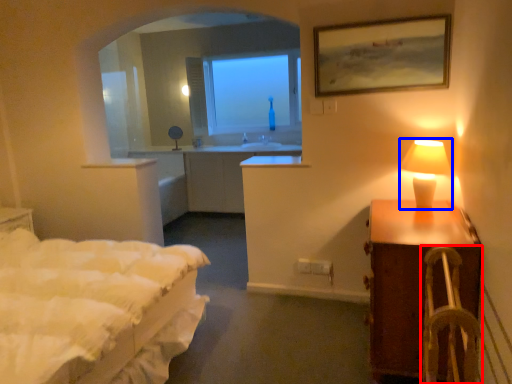
Question: Among these objects, which one is nearest to the camera, armchair (highlighted by a red box) or table lamp (highlighted by a blue box)?

Choices:
 (A) armchair
 (B) table lamp

Answer: (A)